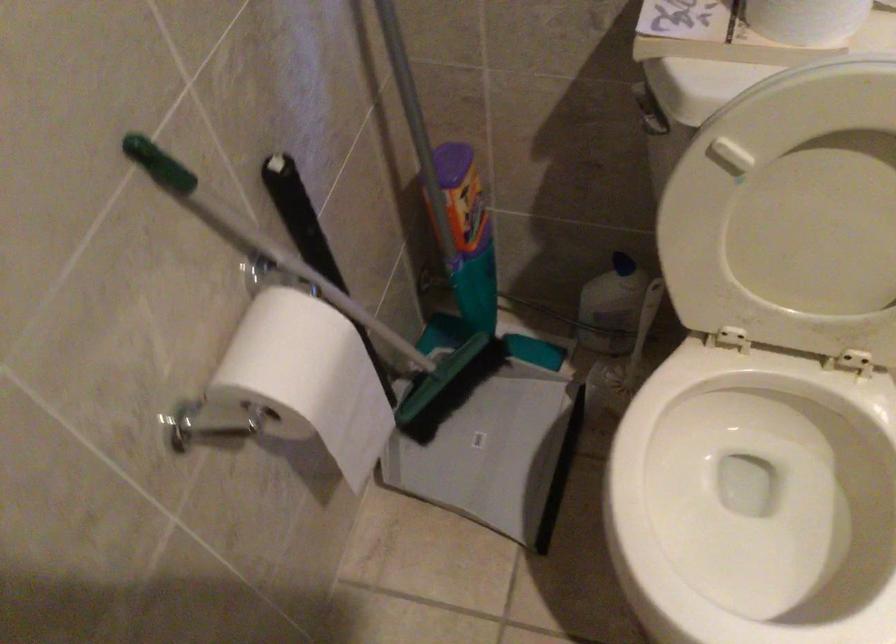
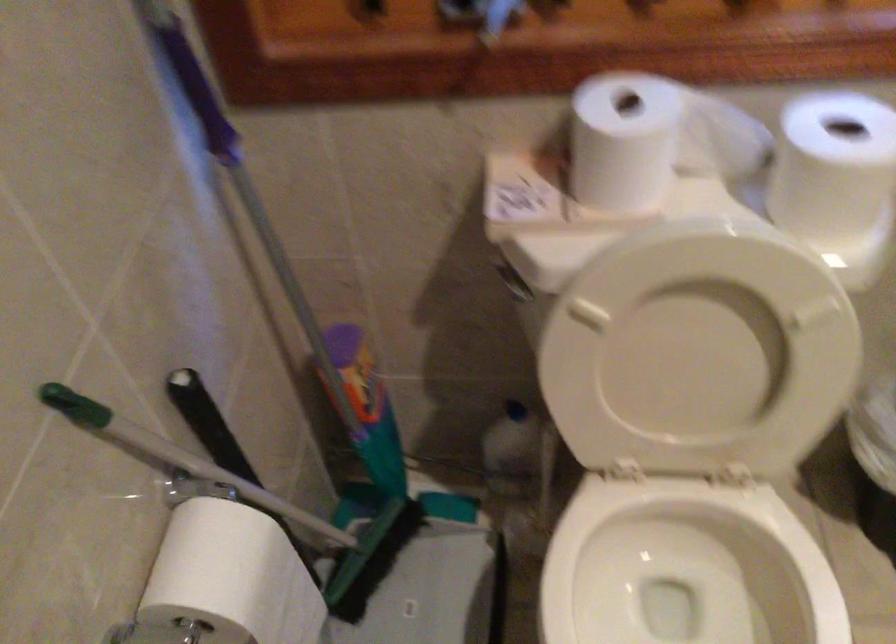
Locate, in the second image, the point that corresponds to point (468, 234) in the first image.

(367, 408)